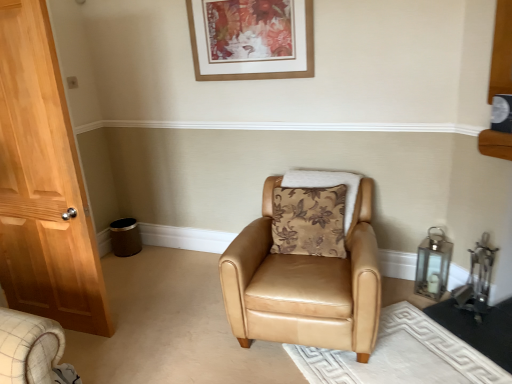
What do you see at coordinates (251, 39) in the screenshot? I see `wooden picture frame at upper center` at bounding box center [251, 39].

What do you see at coordinates (304, 285) in the screenshot? I see `tan leather armchair at center` at bounding box center [304, 285].

At what (x,y) coordinates should I click in order to perform the action: click on brown floral fabric pillow at center. Please return your answer as a coordinate pair (x, y). This screenshot has height=384, width=512. Looking at the image, I should click on (327, 186).

Which object is thinner, brown floral fabric pillow at center or tan leather armchair at center?

brown floral fabric pillow at center is thinner.

At what (x,y) coordinates should I click in order to perform the action: click on chair located in front of the brown floral fabric pillow at center. Please return your answer as a coordinate pair (x, y). The width and height of the screenshot is (512, 384). Looking at the image, I should click on (304, 285).

Which is less distant, (312, 176) or (256, 284)?

The point (256, 284) is closer.

From a real-world perspective, does brown floral fabric pillow at center stand above tan leather armchair at center?

Indeed, from a real-world perspective, brown floral fabric pillow at center stands above tan leather armchair at center.

What's the angular difference between wooden picture frame at upper center and brown floral fabric pillow at center's facing directions?

They differ by 0.298 degrees in their facing directions.

Is the depth of wooden picture frame at upper center greater than that of brown floral fabric pillow at center?

Yes, the depth of wooden picture frame at upper center is greater than that of brown floral fabric pillow at center.

Considering the relative sizes of wooden picture frame at upper center and brown floral fabric pillow at center in the image provided, is wooden picture frame at upper center taller than brown floral fabric pillow at center?

Indeed, wooden picture frame at upper center has a greater height compared to brown floral fabric pillow at center.

Considering the relative positions of wooden picture frame at upper center and brown floral fabric pillow at center in the image provided, is wooden picture frame at upper center to the right of brown floral fabric pillow at center from the viewer's perspective?

No.

How different are the orientations of tan leather armchair at center and wooden picture frame at upper center in degrees?

5.51 degrees.

Does tan leather armchair at center lie in front of wooden picture frame at upper center?

Yes, tan leather armchair at center is in front of wooden picture frame at upper center.

Looking at this image, from a real-world perspective, between tan leather armchair at center and wooden picture frame at upper center, who is vertically higher?

wooden picture frame at upper center, from a real-world perspective.

In the image, there is a wooden picture frame at upper center. Identify the location of chair below it (from the image's perspective). This screenshot has width=512, height=384. (304, 285).

Looking at this image, is brown floral fabric pillow at center with wooden picture frame at upper center?

They are not placed beside each other.

Which point is more forward, (x=351, y=205) or (x=224, y=68)?

Positioned in front is point (x=351, y=205).

From the image's perspective, relative to wooden picture frame at upper center, is brown floral fabric pillow at center above or below?

Based on their image positions, brown floral fabric pillow at center is located beneath wooden picture frame at upper center.

Considering the sizes of objects brown floral fabric pillow at center and wooden picture frame at upper center in the image provided, who is taller, brown floral fabric pillow at center or wooden picture frame at upper center?

wooden picture frame at upper center is taller.

Where is `picture frame that appears above the tan leather armchair at center (from the image's perspective)`? This screenshot has width=512, height=384. picture frame that appears above the tan leather armchair at center (from the image's perspective) is located at coordinates (251, 39).

Does wooden picture frame at upper center touch tan leather armchair at center?

No, wooden picture frame at upper center is not in contact with tan leather armchair at center.

Is wooden picture frame at upper center aimed at tan leather armchair at center?

No, wooden picture frame at upper center is not turned towards tan leather armchair at center.

From the image's perspective, which is above, wooden picture frame at upper center or tan leather armchair at center?

wooden picture frame at upper center, from the image's perspective.

In the scene shown: Is tan leather armchair at center not within brown floral fabric pillow at center?

Yes, tan leather armchair at center is not within brown floral fabric pillow at center.

Which object is further away from the camera taking this photo, tan leather armchair at center or brown floral fabric pillow at center?

Positioned behind is brown floral fabric pillow at center.

Is tan leather armchair at center beside brown floral fabric pillow at center?

No, tan leather armchair at center is not touching brown floral fabric pillow at center.

Does point (348, 272) come behind point (349, 175)?

No, (348, 272) is in front of (349, 175).

The height and width of the screenshot is (384, 512). I want to click on chair that is on the left side of brown floral fabric pillow at center, so click(304, 285).

Image resolution: width=512 pixels, height=384 pixels. Identify the location of pillow on the right of wooden picture frame at upper center. (327, 186).

Estimate the real-world distances between objects in this image. Which object is closer to brown floral fabric pillow at center, tan leather armchair at center or wooden picture frame at upper center?

tan leather armchair at center is closer to brown floral fabric pillow at center.

Which object lies further to the anchor point tan leather armchair at center, brown floral fabric pillow at center or wooden picture frame at upper center?

wooden picture frame at upper center.

In the scene shown: When comparing their distances from wooden picture frame at upper center, does brown floral fabric pillow at center or tan leather armchair at center seem further?

The object further to wooden picture frame at upper center is tan leather armchair at center.

Which object lies nearer to the anchor point tan leather armchair at center, wooden picture frame at upper center or brown floral fabric pillow at center?

Among the two, brown floral fabric pillow at center is located nearer to tan leather armchair at center.

From the image, which object appears to be farther from wooden picture frame at upper center, tan leather armchair at center or brown floral fabric pillow at center?

tan leather armchair at center lies further to wooden picture frame at upper center than the other object.

Estimate the real-world distances between objects in this image. Which object is further from brown floral fabric pillow at center, wooden picture frame at upper center or tan leather armchair at center?

wooden picture frame at upper center.

Find the location of `pillow between wooden picture frame at upper center and tan leather armchair at center vertically`. pillow between wooden picture frame at upper center and tan leather armchair at center vertically is located at coordinates (327, 186).